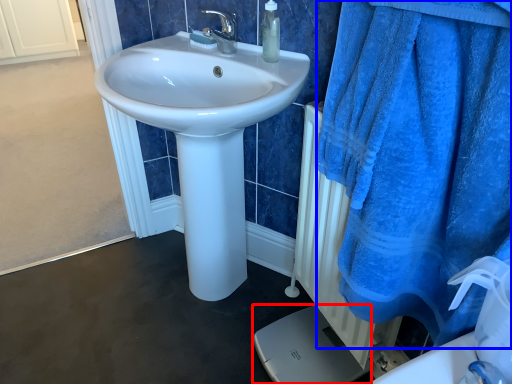
Question: Which object is closer to the camera taking this photo, porcelain (highlighted by a red box) or bath towel (highlighted by a blue box)?

Choices:
 (A) porcelain
 (B) bath towel

Answer: (B)